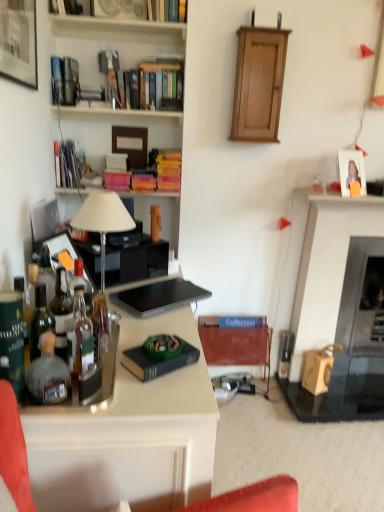
Question: Is matte black picture frame at upper left, which is counted as the 1th picture frame, starting from the front, smaller than black matte laptop at center?

Choices:
 (A) yes
 (B) no

Answer: (B)

Question: Considering the relative sizes of matte black picture frame at upper left, which is the first picture frame from left to right, and black matte laptop at center in the image provided, is matte black picture frame at upper left, which is the first picture frame from left to right, taller than black matte laptop at center?

Choices:
 (A) no
 (B) yes

Answer: (B)

Question: Considering the relative sizes of matte black picture frame at upper left, positioned as the 1th picture frame in top-to-bottom order, and black matte laptop at center in the image provided, is matte black picture frame at upper left, positioned as the 1th picture frame in top-to-bottom order, thinner than black matte laptop at center?

Choices:
 (A) yes
 (B) no

Answer: (A)

Question: From a real-world perspective, is matte black picture frame at upper left, which appears as the second picture frame when viewed from the back, on top of black matte laptop at center?

Choices:
 (A) yes
 (B) no

Answer: (A)

Question: Does matte black picture frame at upper left, which appears as the second picture frame when viewed from the back, lie behind black matte laptop at center?

Choices:
 (A) yes
 (B) no

Answer: (B)

Question: Considering the relative sizes of matte black picture frame at upper left, which appears as the second picture frame when viewed from the back, and black matte laptop at center in the image provided, is matte black picture frame at upper left, which appears as the second picture frame when viewed from the back, wider than black matte laptop at center?

Choices:
 (A) yes
 (B) no

Answer: (B)

Question: From the image's perspective, is wooden bookshelf at upper center, which is the third shelf from top to bottom, located beneath pink matte book at upper left, acting as the sixth book starting from the top?

Choices:
 (A) yes
 (B) no

Answer: (B)

Question: Is wooden bookshelf at upper center, the first shelf in the bottom-to-top sequence, directly adjacent to pink matte book at upper left, which is the 3th book in bottom-to-top order?

Choices:
 (A) no
 (B) yes

Answer: (A)

Question: Does wooden bookshelf at upper center, the first shelf in the bottom-to-top sequence, appear on the left side of pink matte book at upper left, acting as the sixth book starting from the top?

Choices:
 (A) yes
 (B) no

Answer: (B)

Question: Is pink matte book at upper left, which is the 3th book in bottom-to-top order, a part of wooden bookshelf at upper center, the first shelf in the bottom-to-top sequence?

Choices:
 (A) yes
 (B) no

Answer: (B)

Question: Can you confirm if wooden bookshelf at upper center, which is the third shelf from top to bottom, is bigger than pink matte book at upper left, which is the 3th book in bottom-to-top order?

Choices:
 (A) yes
 (B) no

Answer: (A)

Question: Does wooden bookshelf at upper center, which is the third shelf from top to bottom, appear on the right side of pink matte book at upper left, acting as the sixth book starting from the top?

Choices:
 (A) yes
 (B) no

Answer: (A)

Question: Is hardcover book at upper center, placed as the 1th book when sorted from top to bottom, positioned with its back to wooden bookshelf at upper center, which ranks as the first shelf in top-to-bottom order?

Choices:
 (A) yes
 (B) no

Answer: (B)